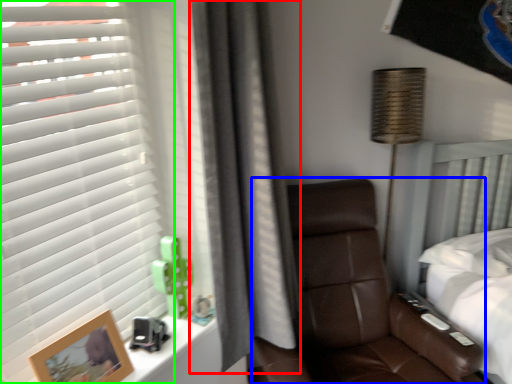
Question: Based on their relative distances, which object is nearer to curtain (highlighted by a red box)? Choose from chair (highlighted by a blue box) and window blind (highlighted by a green box).

Choices:
 (A) chair
 (B) window blind

Answer: (B)